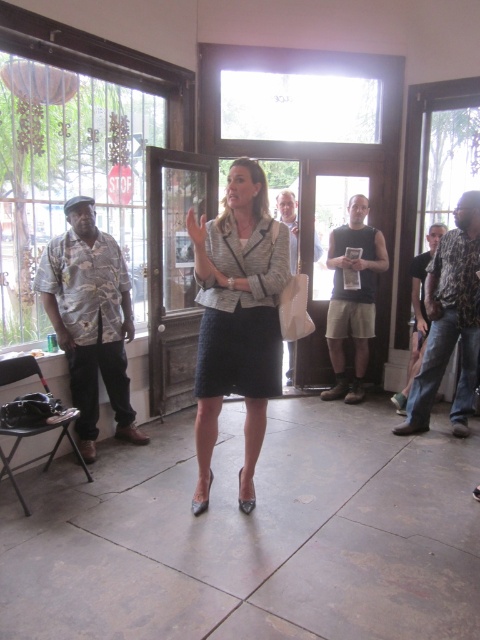
You are an observer in the room. You see the textured gray dress at center and the camouflage shirt at right. Which clothing item is positioned lower in the image?

The textured gray dress at center is located below the camouflage shirt at right, so it is positioned lower in the image.

You are an observer in the room where the woman is speaking. You notice the textured gray dress at center and the camouflage shirt at right. Which of these two items is positioned closer to the left side of the room?

The textured gray dress at center is positioned to the left of the camouflage shirt at right, so it is closer to the left side of the room.

You are a person who is 1.7 meters tall. You are standing in the room and want to reach the textured gray blazer at center. Can you comfortably stretch out your arms to touch it without moving your feet?

The distance between you and the textured gray blazer at center is 2.36 meters. Since the average arm span for a person of your height is about 1.7 meters, you would not be able to comfortably reach it without moving closer.